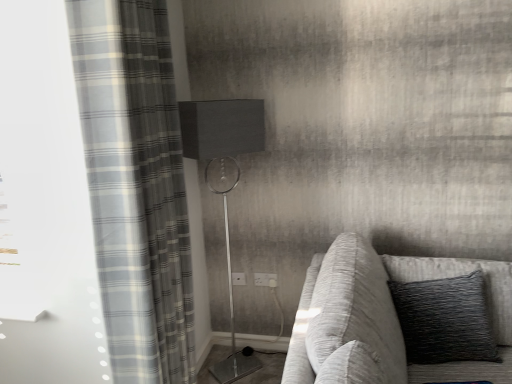
Question: Considering the relative positions of white plastic electric outlet at center, the second electric outlet when ordered from left to right, and textured gray fabric couch at right in the image provided, is white plastic electric outlet at center, the second electric outlet when ordered from left to right, to the left of textured gray fabric couch at right from the viewer's perspective?

Choices:
 (A) yes
 (B) no

Answer: (A)

Question: Is white plastic electric outlet at center, the first electric outlet from the right, outside textured gray fabric couch at right?

Choices:
 (A) yes
 (B) no

Answer: (A)

Question: Is textured gray fabric couch at right a part of white plastic electric outlet at center, the first electric outlet from the right?

Choices:
 (A) no
 (B) yes

Answer: (A)

Question: Is white plastic electric outlet at center, the first electric outlet from the right, to the right of textured gray fabric couch at right from the viewer's perspective?

Choices:
 (A) no
 (B) yes

Answer: (A)

Question: Does white plastic electric outlet at center, the second electric outlet when ordered from left to right, have a lesser height compared to textured gray fabric couch at right?

Choices:
 (A) no
 (B) yes

Answer: (B)

Question: Is metallic silver table lamp at center taller or shorter than gray plaid curtain at left?

Choices:
 (A) tall
 (B) short

Answer: (B)

Question: Would you say metallic silver table lamp at center is inside or outside gray plaid curtain at left?

Choices:
 (A) inside
 (B) outside

Answer: (B)

Question: Is metallic silver table lamp at center bigger or smaller than gray plaid curtain at left?

Choices:
 (A) big
 (B) small

Answer: (B)

Question: From a real-world perspective, relative to gray plaid curtain at left, is metallic silver table lamp at center vertically above or below?

Choices:
 (A) below
 (B) above

Answer: (A)

Question: In the image, is white plastic electric outlet at center, arranged as the second electric outlet when viewed from the right, on the left side or the right side of textured gray fabric couch at right?

Choices:
 (A) left
 (B) right

Answer: (A)

Question: From a real-world perspective, is white plastic electric outlet at center, arranged as the second electric outlet when viewed from the right, above or below textured gray fabric couch at right?

Choices:
 (A) above
 (B) below

Answer: (B)

Question: Considering their positions, is white plastic electric outlet at center, the first electric outlet viewed from the left, located in front of or behind textured gray fabric couch at right?

Choices:
 (A) front
 (B) behind

Answer: (B)

Question: In terms of height, does white plastic electric outlet at center, arranged as the second electric outlet when viewed from the right, look taller or shorter compared to textured gray fabric couch at right?

Choices:
 (A) tall
 (B) short

Answer: (B)

Question: In the image, is white plastic electric outlet at center, the first electric outlet from the right, positioned in front of or behind gray plaid curtain at left?

Choices:
 (A) behind
 (B) front

Answer: (A)

Question: Choose the correct answer: Is white plastic electric outlet at center, the first electric outlet from the right, inside gray plaid curtain at left or outside it?

Choices:
 (A) inside
 (B) outside

Answer: (B)